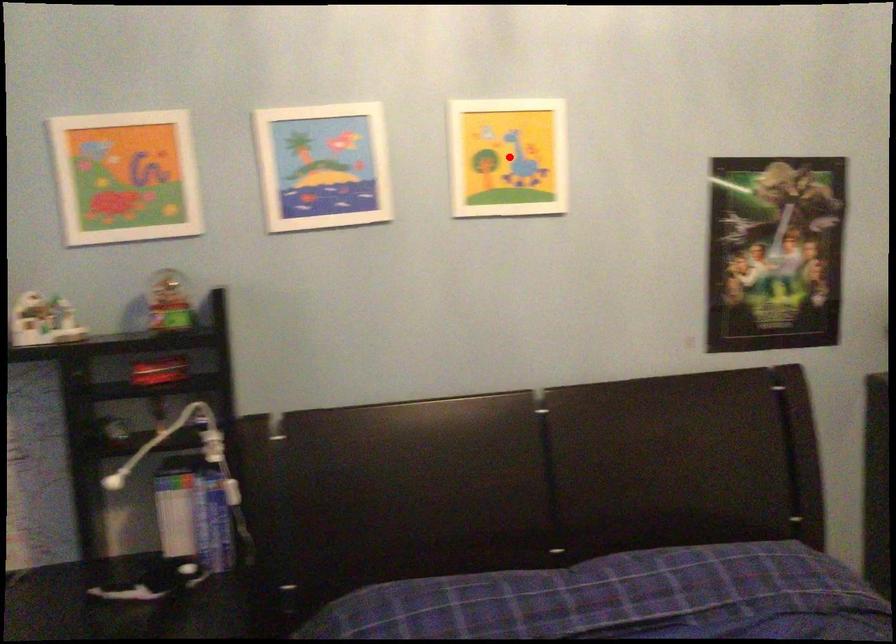
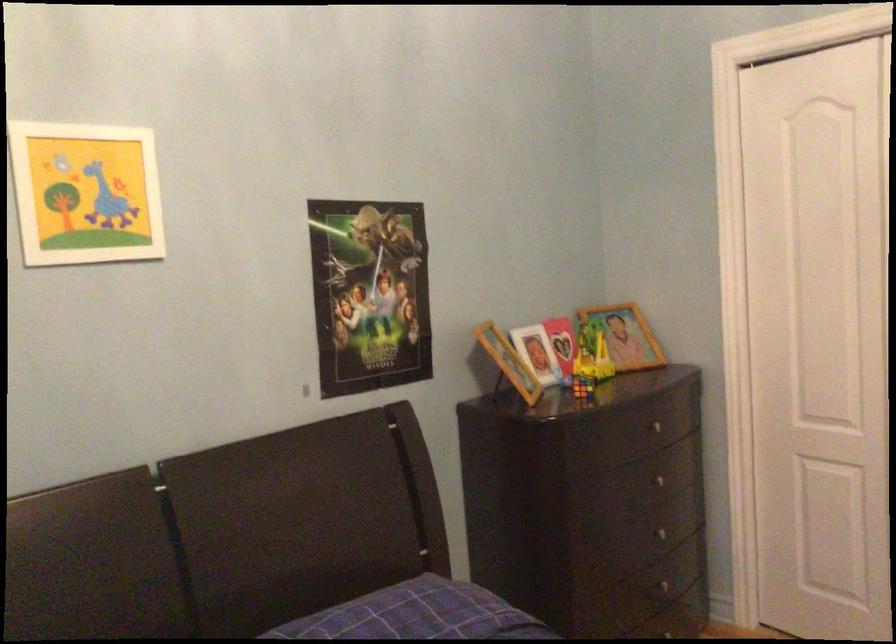
Question: I am providing you with two images of the same scene from different viewpoints. A red point is shown in image1. For the corresponding object point in image2, is it positioned nearer or farther from the camera?

Choices:
 (A) Nearer
 (B) Farther

Answer: (A)